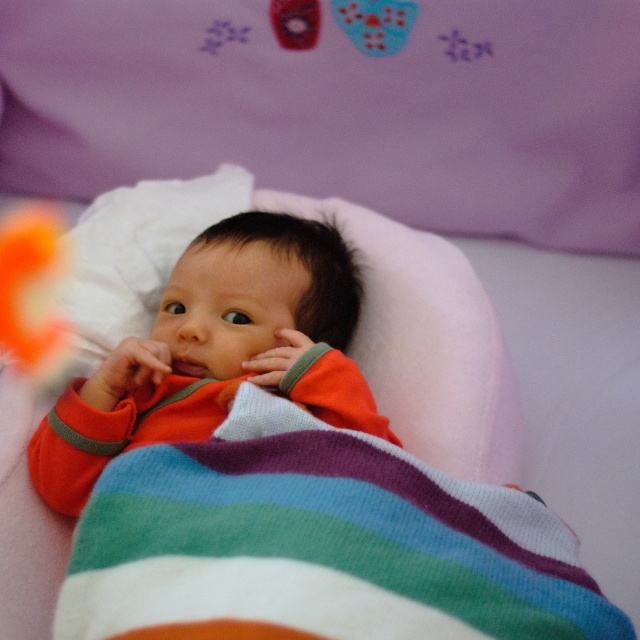
You are a photographer trying to capture the baby in the image. Since the multicolored knitted blanket at center and the orange soft fabric baby at center are both in the frame, which one should you focus on if you want to ensure the subject is larger in your photo?

The orange soft fabric baby at center is larger than the multicolored knitted blanket at center, so focusing on the orange soft fabric baby at center will ensure the subject appears larger in the photo.

You are a photographer setting up for a baby photo shoot. You need to ensure the orange soft fabric baby at center is visible without being blocked by the orange plush toy at left. Based on the scene description, is the current arrangement suitable?

The orange soft fabric baby at center is in front of the orange plush toy at left, so the baby is not blocked and the current arrangement is suitable.

You are holding a 100 cm long ruler and want to measure the distance from your eyes to the point at coordinates point (304, 374) in the image. Can you reach the point with the ruler?

The distance of point (304, 374) from viewer is 98.41 centimeters, so yes, the ruler can reach the point since it is shorter than the ruler length.